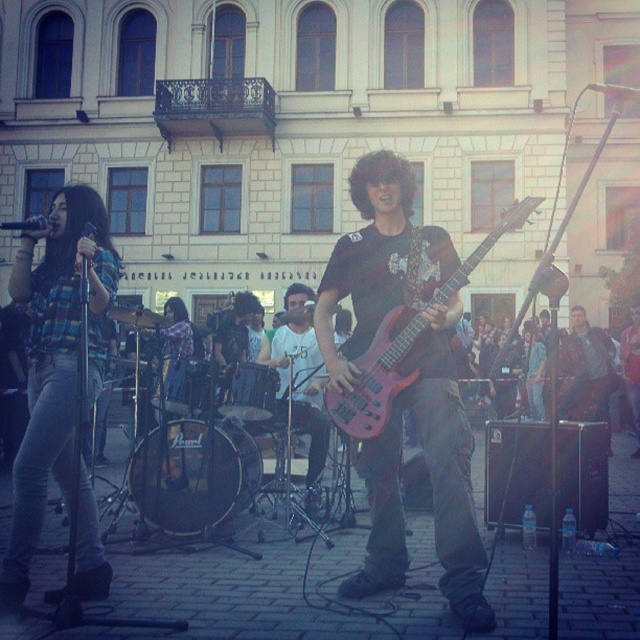
Question: Can you confirm if shiny red electric guitar at center is positioned above metallic silver microphone at upper right?

Choices:
 (A) no
 (B) yes

Answer: (A)

Question: Which of the following is the closest to the observer?

Choices:
 (A) metallic silver microphone at upper right
 (B) matte black guitar at center
 (C) plaid fabric shirt at left

Answer: (A)

Question: Which is nearer to the brushed metal microphone at upper left?

Choices:
 (A) matte black guitar at center
 (B) plaid fabric shirt at left
 (C) shiny red electric guitar at center
 (D) metallic silver microphone at upper right

Answer: (C)

Question: Is matte black guitar at center thinner than brushed metal microphone at upper left?

Choices:
 (A) yes
 (B) no

Answer: (A)

Question: Which is farther from the brushed metal microphone at upper left?

Choices:
 (A) plaid fabric shirt at left
 (B) shiny red electric guitar at center
 (C) metallic silver microphone at upper right

Answer: (C)

Question: Can you confirm if plaid fabric shirt at left is positioned above metallic silver microphone at upper right?

Choices:
 (A) no
 (B) yes

Answer: (A)